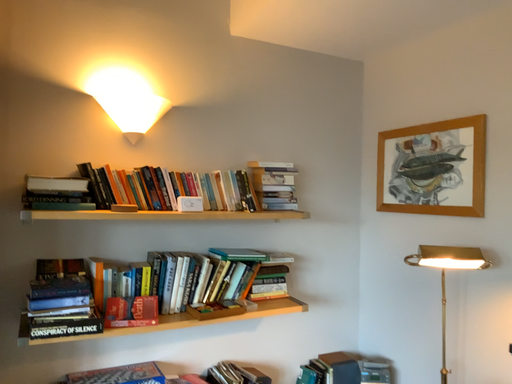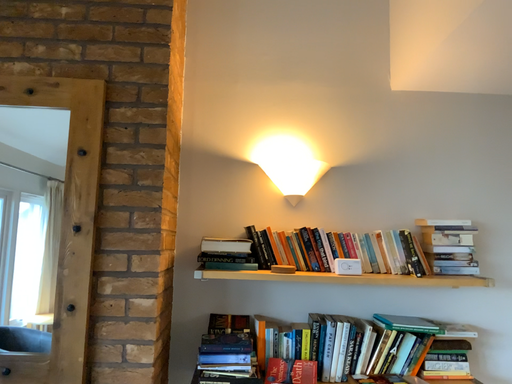
Question: Which way did the camera rotate in the video?

Choices:
 (A) rotated upward
 (B) rotated downward

Answer: (A)